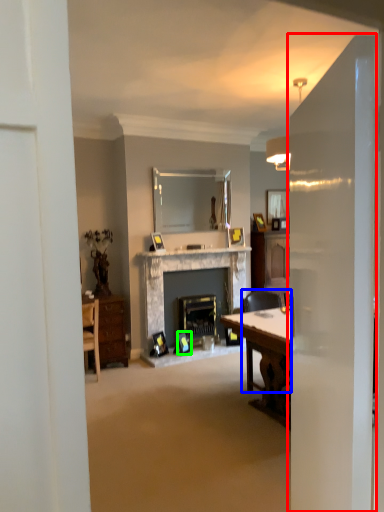
Question: Based on their relative distances, which object is nearer to glass door (highlighted by a red box)? Choose from chair (highlighted by a blue box) and picture frame (highlighted by a green box).

Choices:
 (A) chair
 (B) picture frame

Answer: (A)